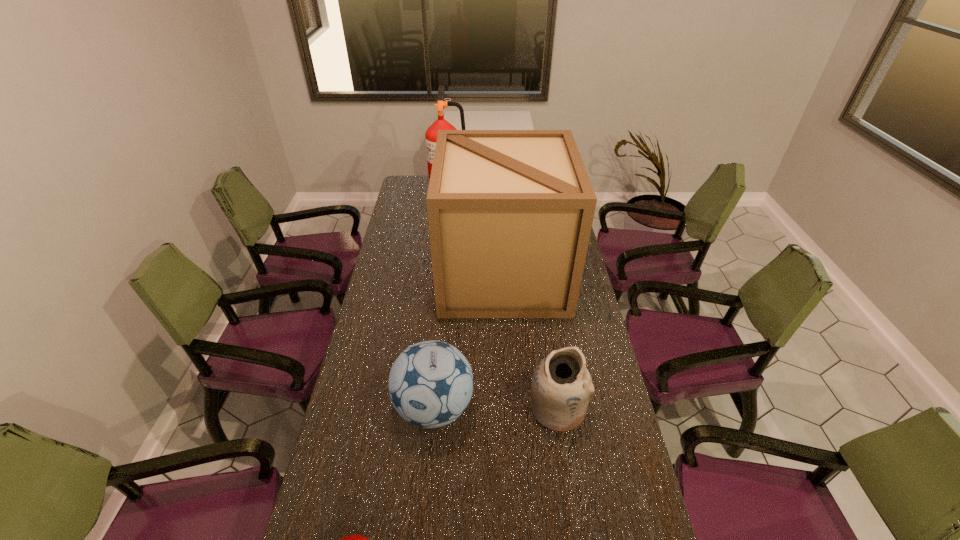
This screenshot has width=960, height=540. What are the coordinates of `object present at the far edge` in the screenshot? It's located at (431, 134).

Where is `fire extinguisher positioned at the left edge`? The height and width of the screenshot is (540, 960). fire extinguisher positioned at the left edge is located at coordinates (431, 134).

Find the location of a particular element. soccer ball situated at the left edge is located at coordinates (431, 383).

In order to click on box at the right edge in this screenshot , I will do `click(510, 212)`.

This screenshot has height=540, width=960. I want to click on pottery located at the right edge, so click(x=561, y=386).

You are a GUI agent. You are given a task and a screenshot of the screen. Output one action in this format:
    pyautogui.click(x=<x>, y=<y>)
    Task: Click on the object located at the far left corner
    
    Given the screenshot: What is the action you would take?
    pyautogui.click(x=431, y=134)

I want to click on free location at the right edge of the desktop, so click(x=611, y=457).

Locate an element on the screen. Image resolution: width=960 pixels, height=540 pixels. vacant space at the far left corner is located at coordinates (414, 180).

Image resolution: width=960 pixels, height=540 pixels. Find the location of `vacant space that is in between the soccer ball and the pottery`. vacant space that is in between the soccer ball and the pottery is located at coordinates (495, 408).

Where is `free space between the pottery and the second farthest object`? This screenshot has height=540, width=960. free space between the pottery and the second farthest object is located at coordinates (530, 340).